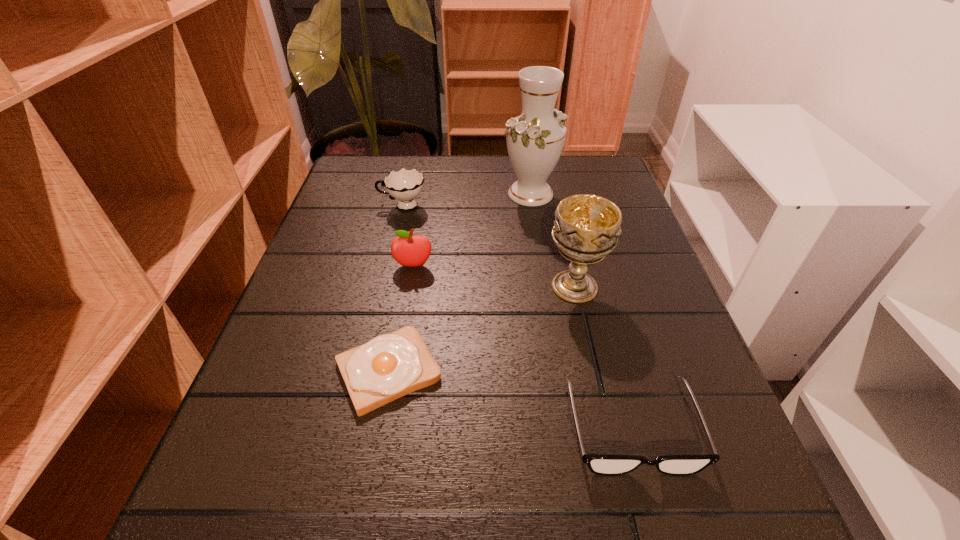
At what (x,y) coordinates should I click in order to perform the action: click on free space between the fifth tallest object and the tallest object. Please return your answer as a coordinate pair (x, y). This screenshot has height=540, width=960. Looking at the image, I should click on (581, 311).

Where is `free point between the shortest object and the second tallest object`? The width and height of the screenshot is (960, 540). free point between the shortest object and the second tallest object is located at coordinates (481, 329).

Image resolution: width=960 pixels, height=540 pixels. Find the location of `vacant space that's between the tallest object and the fourth shortest object`. vacant space that's between the tallest object and the fourth shortest object is located at coordinates (472, 230).

This screenshot has height=540, width=960. Find the location of `blank region between the second tallest object and the fourth tallest object`. blank region between the second tallest object and the fourth tallest object is located at coordinates (489, 246).

The width and height of the screenshot is (960, 540). What are the coordinates of `vacant space in between the shortest object and the vase` in the screenshot? It's located at (460, 282).

You are a GUI agent. You are given a task and a screenshot of the screen. Output one action in this format:
    pyautogui.click(x=<x>, y=<y>)
    Task: Click on the vacant region between the spectacles and the third tallest object
    
    Given the screenshot: What is the action you would take?
    pyautogui.click(x=522, y=347)

You are a GUI agent. You are given a task and a screenshot of the screen. Output one action in this format:
    pyautogui.click(x=<x>, y=<y>)
    Task: Click on the free area in between the spectacles and the apple
    
    Given the screenshot: What is the action you would take?
    pyautogui.click(x=522, y=347)

Select which object is the second closest to the chalice. Please provide its 2D coordinates. Your answer should be formatted as a tuple, i.e. [(x, y)], where the tuple contains the x and y coordinates of a point satisfying the conditions above.

[(390, 366)]

Identify the location of object that is the second closest to the third tallest object. (390, 366).

Find the location of `vacant space that satisfies the following two spatial constraints: 1. on the front side of the chalice; 2. on the left side of the vase`. vacant space that satisfies the following two spatial constraints: 1. on the front side of the chalice; 2. on the left side of the vase is located at coordinates (545, 287).